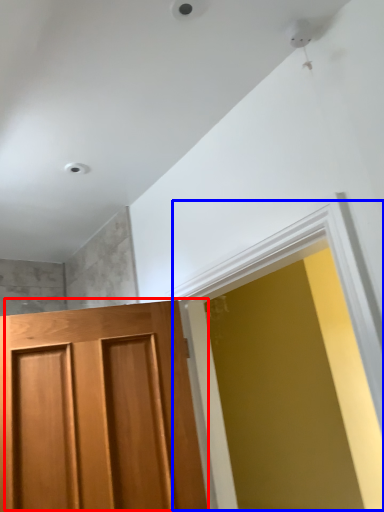
Question: Which of the following is the closest to the observer, door (highlighted by a red box) or window (highlighted by a blue box)?

Choices:
 (A) door
 (B) window

Answer: (B)